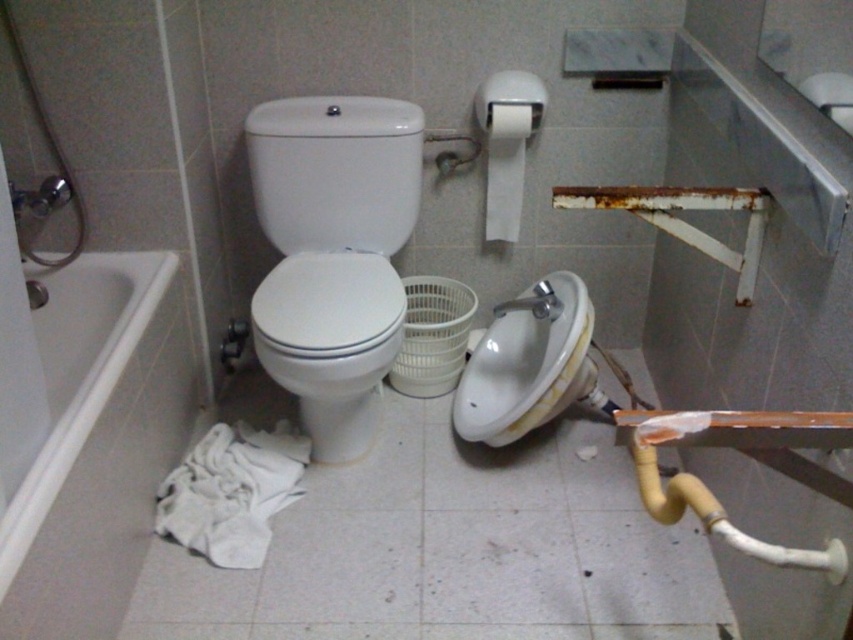
You are standing in the bathroom and want to determine which of the two points, point (310, 298) or point (520, 125), is closer to you. Based on the scene description, which point is nearer?

Point (310, 298) is closer to the viewer than point (520, 125).

You are standing at the entrance of the bathroom and see two points marked on the floor. The first point is at coordinate point(91, 301) and the second is at point(279, 221). Which point is closer to you?

Point(91, 301) is in front of point(279, 221), so it is closer to you.